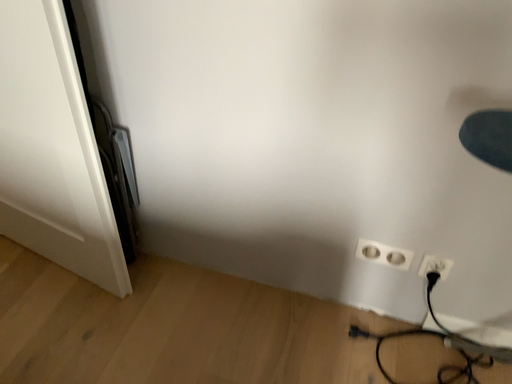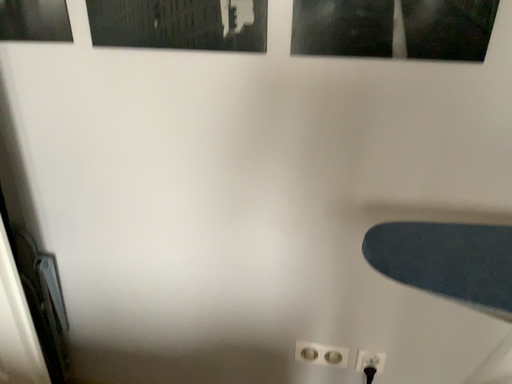
Question: Which way did the camera rotate in the video?

Choices:
 (A) rotated left
 (B) rotated right

Answer: (B)